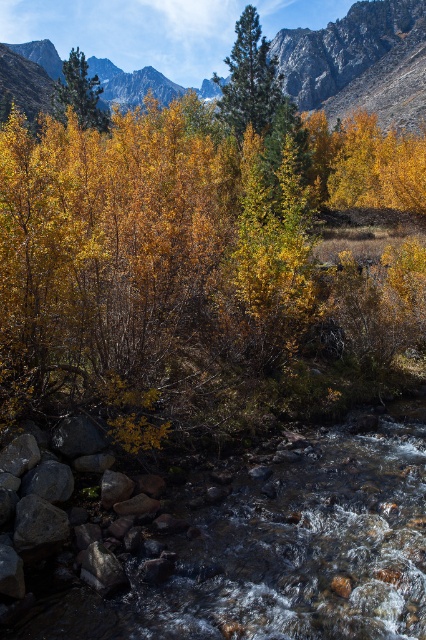
Describe the element at coordinates (359, 61) in the screenshot. I see `rugged granite mountain at upper center` at that location.

Which of these two, rugged granite mountain at upper center or green matte tree at center, stands shorter?

green matte tree at center is shorter.

This screenshot has width=426, height=640. In order to click on rugged granite mountain at upper center in this screenshot , I will do `click(359, 61)`.

Does yellow-green leaves at center appear under green matte tree at center?

Indeed, yellow-green leaves at center is positioned under green matte tree at center.

Is yellow-green leaves at center closer to camera compared to green matte tree at center?

Yes, it is in front of green matte tree at center.

Is point (60, 394) positioned in front of point (244, 74)?

Yes.

Locate an element on the screen. yellow-green leaves at center is located at coordinates (193, 268).

Which is in front, point (57, 356) or point (354, 40)?

Positioned in front is point (57, 356).

Does point (3, 264) come behind point (166, 99)?

That is False.

Image resolution: width=426 pixels, height=640 pixels. Identify the location of yellow-green leaves at center. (193, 268).